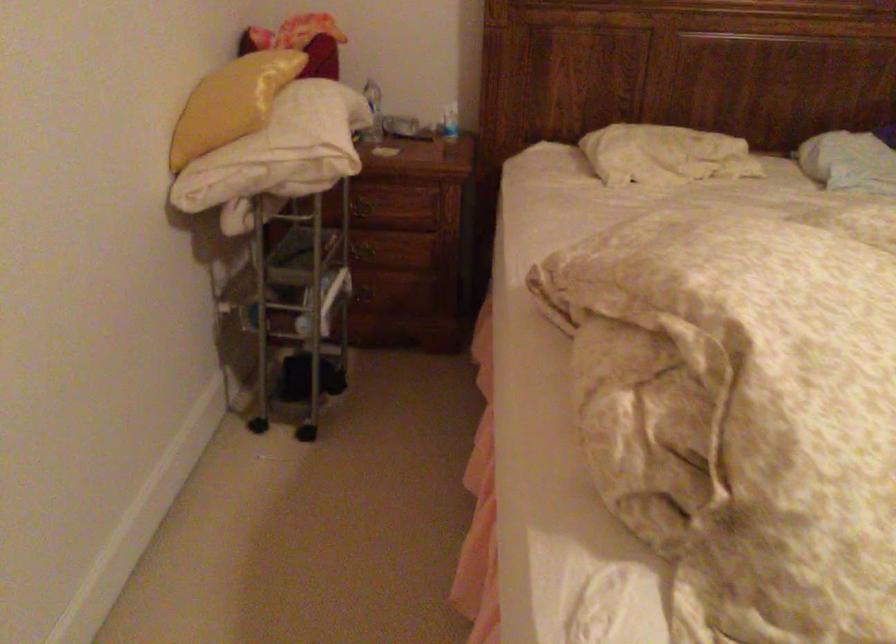
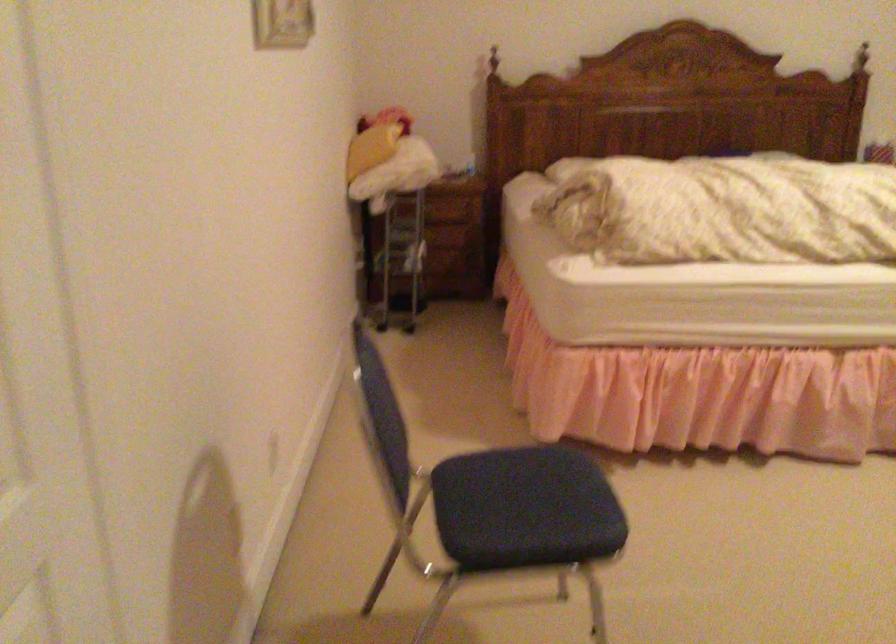
Question: The images are taken continuously from a first-person perspective. In which direction are you moving?

Choices:
 (A) Left
 (B) Right
 (C) Forward
 (D) Backward

Answer: (D)